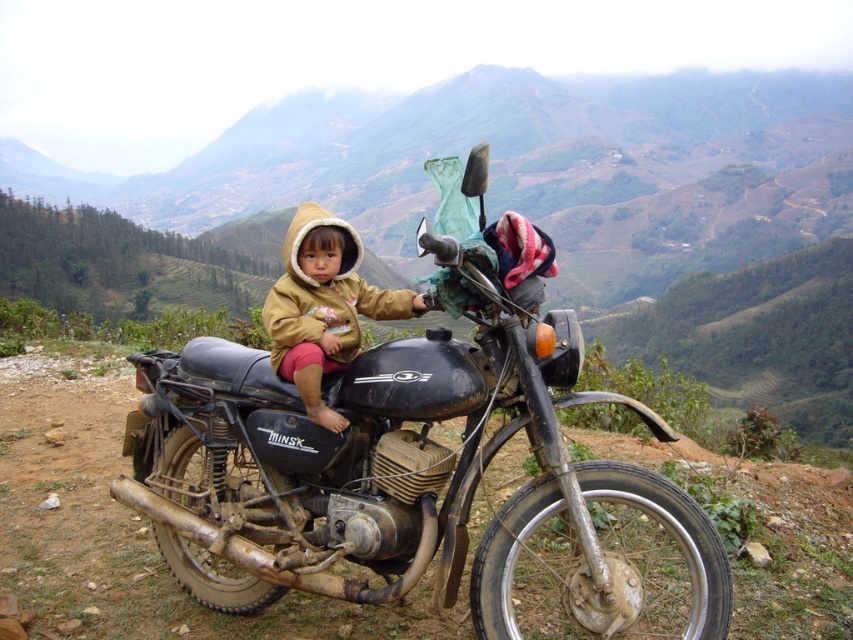
You are a photographer setting up a tripod in this scene. You want to place the tripod so that it is closer to the viewer than both points, point [564,564] and point [351,288]. Is this possible?

Point [564,564] is further to the viewer than point [351,288]. Therefore, placing the tripod closer to the viewer than both points is not possible since the closest point to the viewer is point [351,288].

You are a photographer trying to capture the motorcycle in the center. You need to place a light at the point with coordinates point (409, 461). Is this point located on the motorcycle?

Yes, the point (409, 461) is on the black matte motorcycle at center, so placing the light there will illuminate the motorcycle directly.

You are a photographer trying to capture the black matte motorcycle at center and the fuzzy brown jacket at center in a single frame. Which object should you focus on first if you want to ensure both are in focus, considering their sizes and positions?

The black matte motorcycle at center is much taller than the fuzzy brown jacket at center, so focusing on the motorcycle first would help ensure both are in focus due to its larger size and central position.